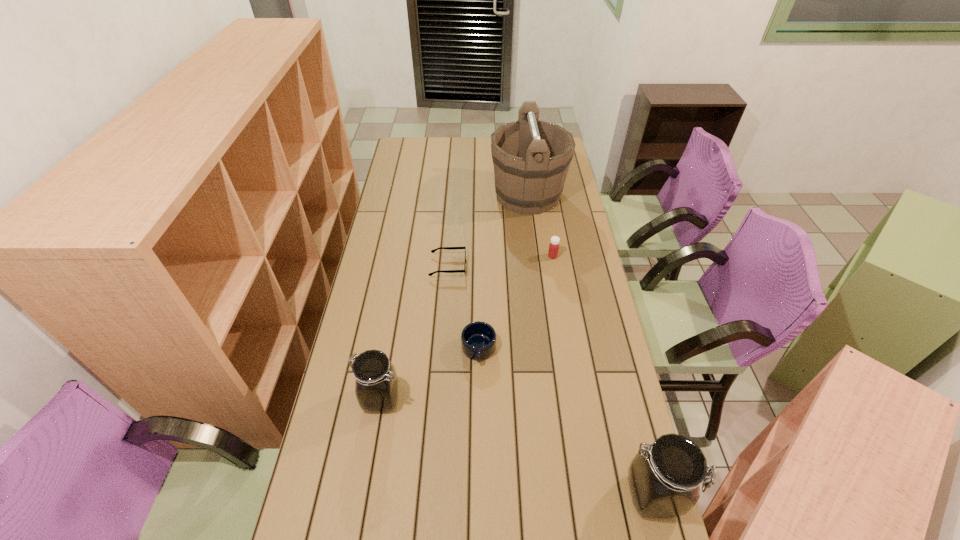
To ensure equal spacing by inserting another jar among them, please point out a vacant spot for this new jar. Please provide its 2D coordinates. Your answer should be formatted as a tuple, i.e. [(x, y)], where the tuple contains the x and y coordinates of a point satisfying the conditions above.

[(507, 443)]